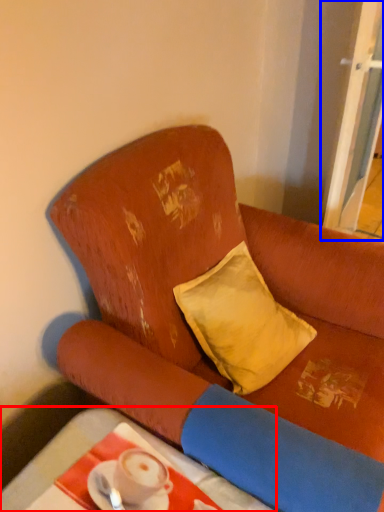
Question: Which object appears closest to the camera in this image, table (highlighted by a red box) or screen door (highlighted by a blue box)?

Choices:
 (A) table
 (B) screen door

Answer: (A)